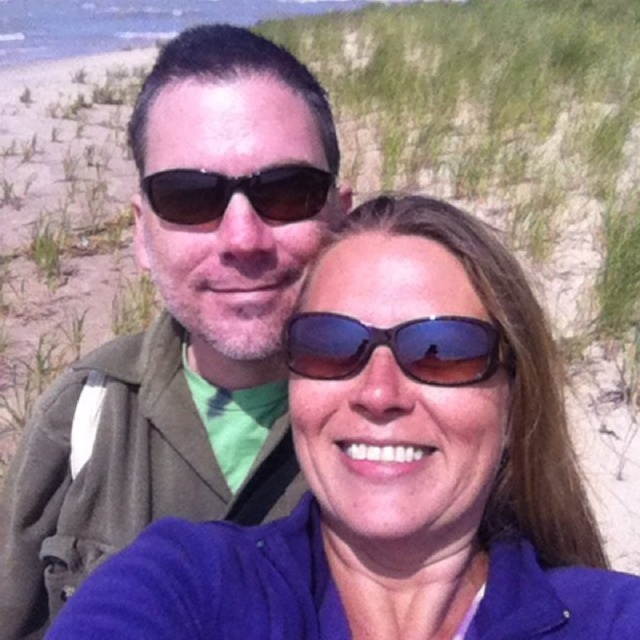
Is matte green jacket at center below blue reflective sunglasses at center?

Incorrect, matte green jacket at center is not positioned below blue reflective sunglasses at center.

Is matte green jacket at center to the left of blue reflective sunglasses at center from the viewer's perspective?

Correct, you'll find matte green jacket at center to the left of blue reflective sunglasses at center.

Which is behind, point (228, 262) or point (298, 365)?

The point (228, 262) is behind.

Identify the location of matte green jacket at center. (184, 324).

Does blue fabric at center lie behind blue reflective sunglasses at center?

No.

Between blue fabric at center and blue reflective sunglasses at center, which one has less height?

blue reflective sunglasses at center

Find the location of a particular element. blue fabric at center is located at coordinates (394, 468).

I want to click on blue fabric at center, so click(394, 468).

Is point (330, 304) farther from viewer compared to point (51, 390)?

No, (330, 304) is in front of (51, 390).

Between blue fabric at center and matte green jacket at center, which one has less height?

Standing shorter between the two is blue fabric at center.

Does point (365, 237) come in front of point (58, 412)?

Yes, it is in front of point (58, 412).

Where is `blue fabric at center`? This screenshot has height=640, width=640. blue fabric at center is located at coordinates (394, 468).